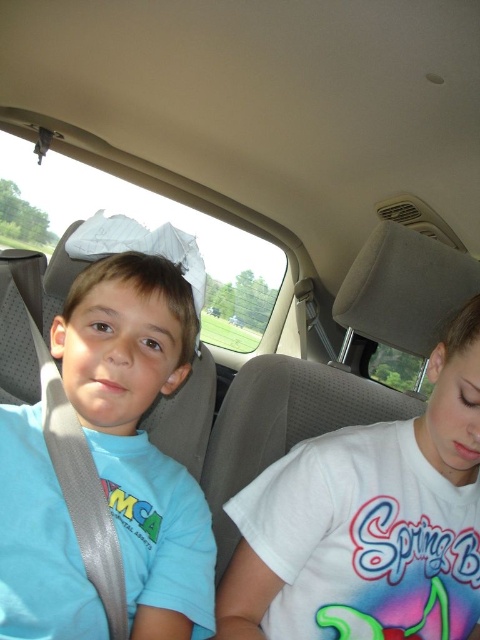
Can you confirm if white cotton shirt at right is shorter than matte blue shirt at left?

No, white cotton shirt at right is not shorter than matte blue shirt at left.

Between white cotton shirt at right and matte blue shirt at left, which one is positioned lower?

white cotton shirt at right is lower down.

The width and height of the screenshot is (480, 640). Describe the element at coordinates (369, 522) in the screenshot. I see `white cotton shirt at right` at that location.

Where is `white cotton shirt at right`? white cotton shirt at right is located at coordinates (369, 522).